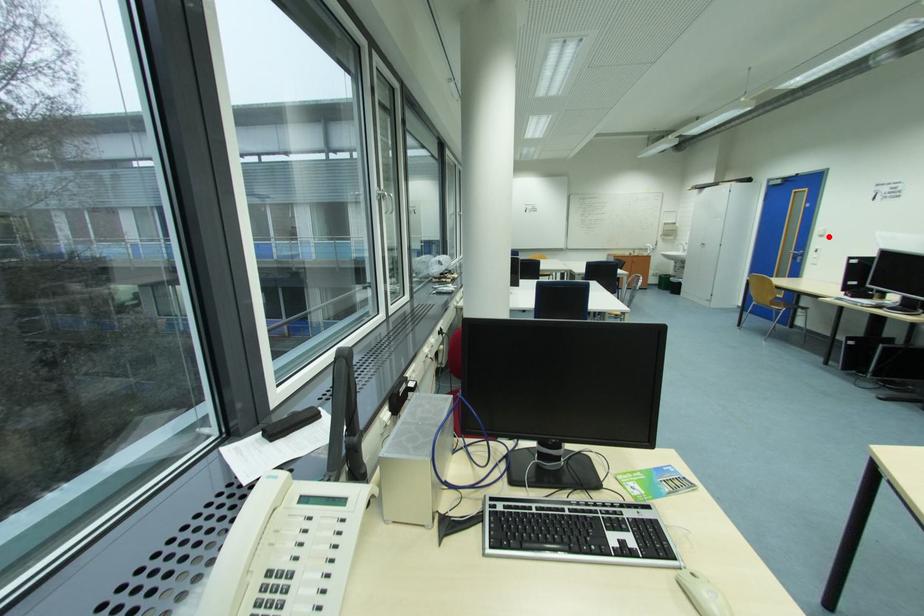
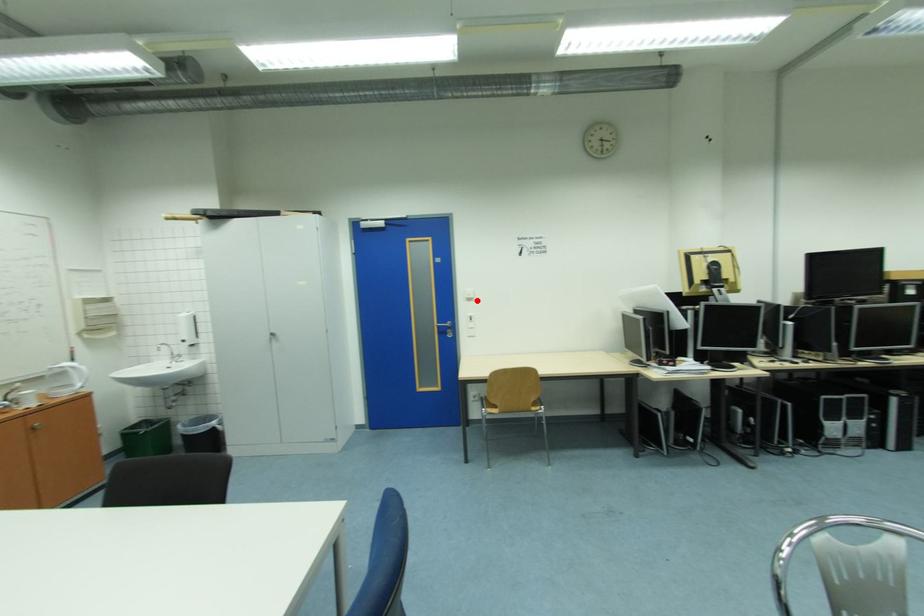
I am providing you with two images of the same scene from different viewpoints. A red point is marked on the first image and another point is marked on the second image. Are the points marked in image1 and image2 representing the same 3D position?

Yes